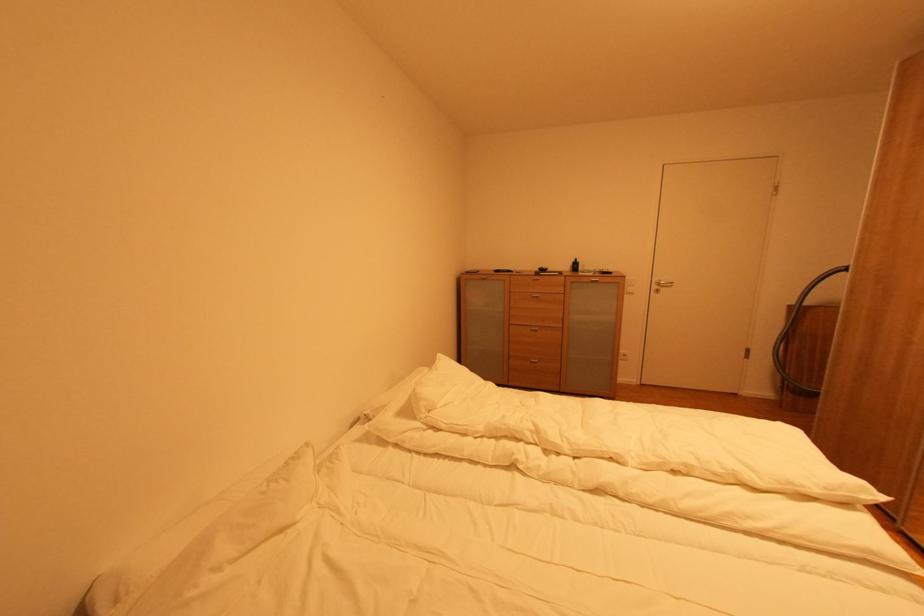
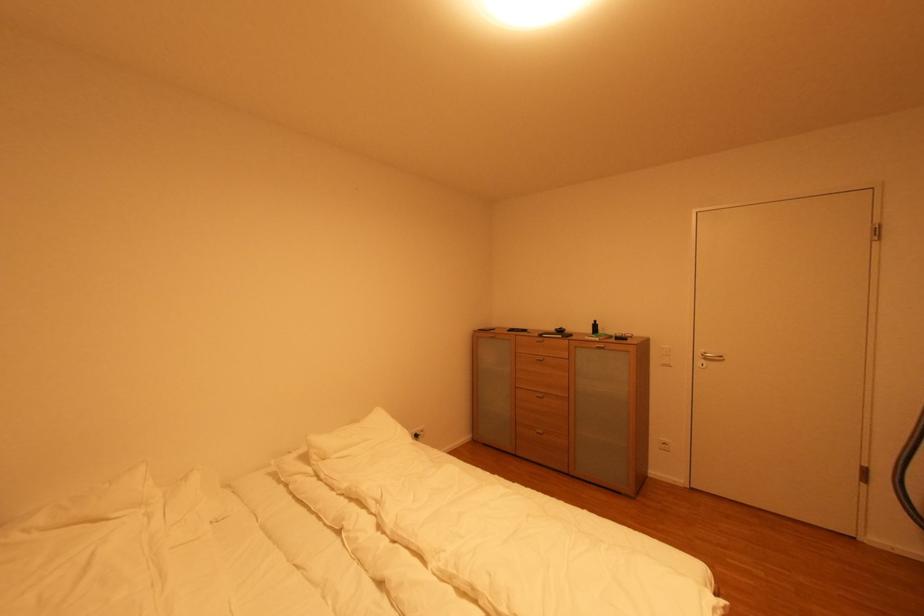
Find the pixel in the second image that matches (434,411) in the first image.

(330, 461)